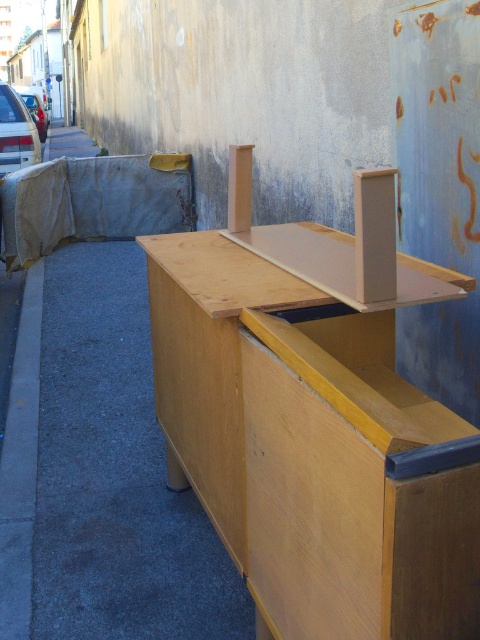
Which is above, light brown wood table at center or wooden bench at right?

Positioned higher is light brown wood table at center.

Is light brown wood table at center to the right of wooden bench at right from the viewer's perspective?

Correct, you'll find light brown wood table at center to the right of wooden bench at right.

Where is `light brown wood table at center`? Image resolution: width=480 pixels, height=640 pixels. light brown wood table at center is located at coordinates (309, 449).

You are a GUI agent. You are given a task and a screenshot of the screen. Output one action in this format:
    pyautogui.click(x=<x>, y=<y>)
    Task: Click on the light brown wood table at center
    This screenshot has height=640, width=480.
    Given the screenshot: What is the action you would take?
    pyautogui.click(x=309, y=449)